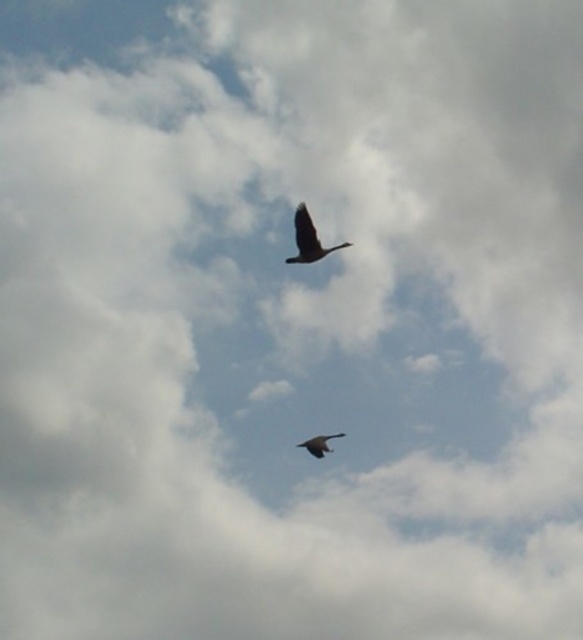
Where is `dark brown feathered bird at upper center`? This screenshot has height=640, width=583. dark brown feathered bird at upper center is located at coordinates (308, 237).

Between point (305, 221) and point (314, 448), which one is positioned in front?

Positioned in front is point (305, 221).

This screenshot has height=640, width=583. Find the location of `dark brown feathered bird at upper center`. dark brown feathered bird at upper center is located at coordinates (308, 237).